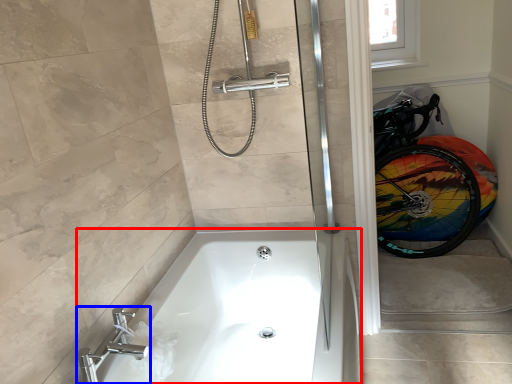
Question: Which object is further to the camera taking this photo, bathtub (highlighted by a red box) or tap (highlighted by a blue box)?

Choices:
 (A) bathtub
 (B) tap

Answer: (B)